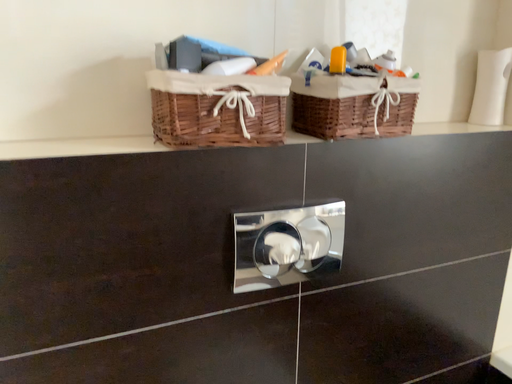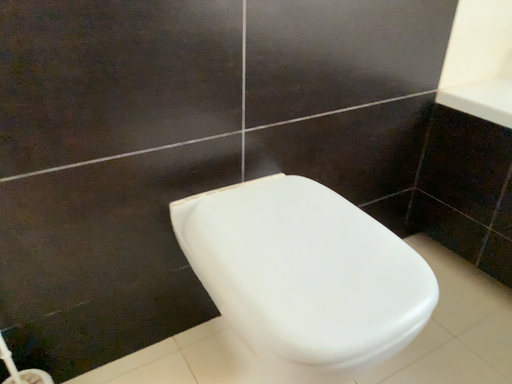
Question: Which way did the camera rotate in the video?

Choices:
 (A) rotated downward
 (B) rotated upward

Answer: (A)